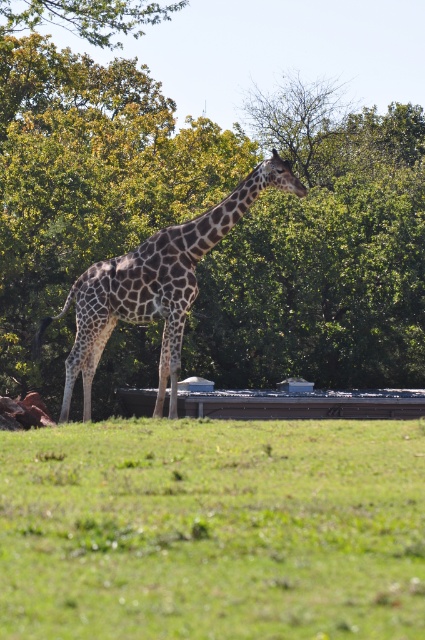
Between green grass at center and spotted fur giraffe at center, which one has less height?

green grass at center

Consider the image. Does green grass at center appear on the right side of spotted fur giraffe at center?

Correct, you'll find green grass at center to the right of spotted fur giraffe at center.

Describe the element at coordinates (212, 531) in the screenshot. This screenshot has width=425, height=640. I see `green grass at center` at that location.

Where is `green grass at center`? green grass at center is located at coordinates (212, 531).

Is green leafy tree at center below green grass at center?

Incorrect, green leafy tree at center is not positioned below green grass at center.

Based on the photo, is green leafy tree at center thinner than green grass at center?

In fact, green leafy tree at center might be wider than green grass at center.

Does point (360, 332) come closer to viewer compared to point (243, 467)?

No, it is not.

Where is `green leafy tree at center`? Image resolution: width=425 pixels, height=640 pixels. green leafy tree at center is located at coordinates (203, 209).

Between green leafy tree at center and spotted fur giraffe at center, which one is positioned lower?

Positioned lower is spotted fur giraffe at center.

Can you confirm if green leafy tree at center is taller than spotted fur giraffe at center?

Correct, green leafy tree at center is much taller as spotted fur giraffe at center.

Between point (384, 371) and point (71, 376), which one is positioned behind?

The point (384, 371) is behind.

This screenshot has height=640, width=425. Find the location of `green leafy tree at center`. green leafy tree at center is located at coordinates (203, 209).